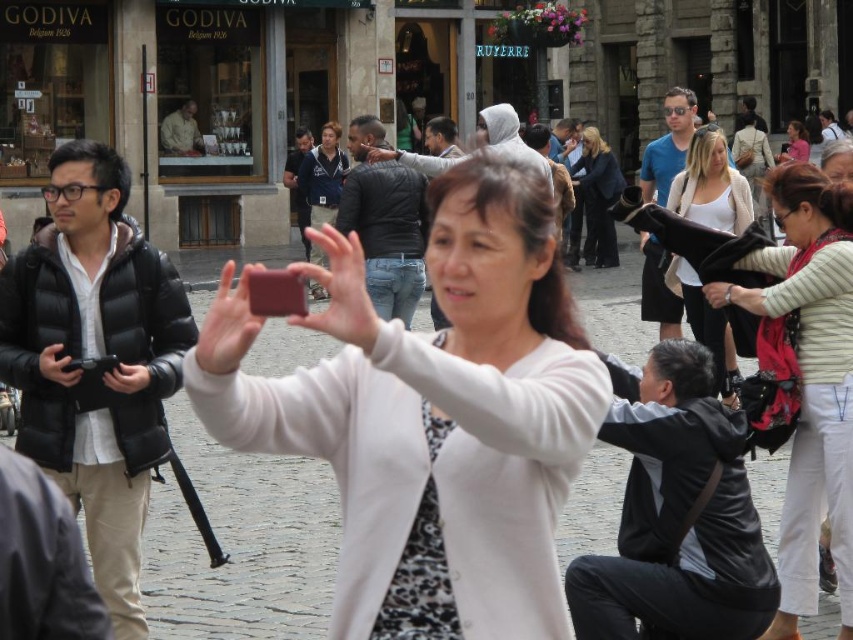
You are a photographer trying to capture the exact position of the matte pink phone at center in this street scene. If the image is represented as a coordinate system where the bottom left corner is the origin point, can you determine the phone location in terms of coordinates?

The matte pink phone at center is located at coordinates point [340,289].

You are standing in the middle of the street and want to take a photo of both the point at coordinates (691, 140) and the point at (606, 220). Which point should you focus on first to ensure both are in clear view?

You should focus on the point at coordinates (691, 140) first because it is closer to you than the point at (606, 220), ensuring both points remain in clear view when adjusting the camera.

You are a photographer standing 10 meters away from the camera. You want to take a photo of the matte pink phone at center using your camera. Can you reach the phone with your camera from your current position?

The matte pink phone at center and camera are 16.89 meters apart from each other. Since you are 10 meters away from the camera, the total distance between you and the phone is 26.89 meters. Most cameras have a maximum focusing distance of around 100 meters, so it should be possible to capture the phone at that distance, provided there are no obstructions.